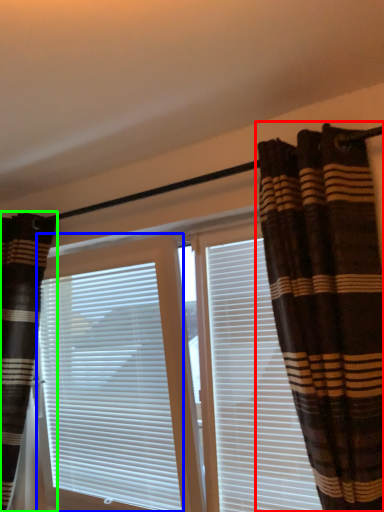
Question: Based on their relative distances, which object is farther from curtain (highlighted by a red box)? Choose from window blind (highlighted by a blue box) and curtain (highlighted by a green box).

Choices:
 (A) window blind
 (B) curtain

Answer: (B)